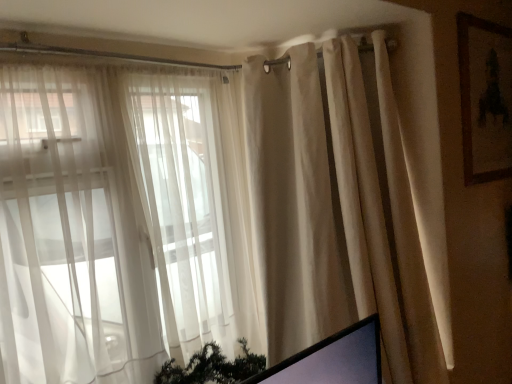
Find the location of `sheer white curtains at left`. sheer white curtains at left is located at coordinates (94, 229).

You are a GUI agent. You are given a task and a screenshot of the screen. Output one action in this format:
    pyautogui.click(x=<x>, y=<y>)
    Task: Click on the brown wooden picture frame at upper right
    The width and height of the screenshot is (512, 384).
    Given the screenshot: What is the action you would take?
    pyautogui.click(x=485, y=98)

You are a GUI agent. You are given a task and a screenshot of the screen. Output one action in this format:
    pyautogui.click(x=<x>, y=<y>)
    Task: Click on the beige fabric curtain at right
    
    Given the screenshot: What is the action you would take?
    pyautogui.click(x=334, y=210)

Looking at this image, from the image's perspective, would you say beige fabric curtain at right is positioned over brown wooden picture frame at upper right?

Incorrect, from the image's perspective, beige fabric curtain at right is lower than brown wooden picture frame at upper right.

How different are the orientations of beige fabric curtain at right and brown wooden picture frame at upper right in degrees?

There is a 48.9-degree angle between the facing directions of beige fabric curtain at right and brown wooden picture frame at upper right.

Could you tell me if beige fabric curtain at right is facing brown wooden picture frame at upper right?

No, beige fabric curtain at right is not aimed at brown wooden picture frame at upper right.

Which object is wider, beige fabric curtain at right or sheer white curtains at left?

beige fabric curtain at right is wider.

Looking at this image, can sheer white curtains at left be found inside beige fabric curtain at right?

Definitely not — sheer white curtains at left is not inside beige fabric curtain at right.

From a real-world perspective, is beige fabric curtain at right above or below sheer white curtains at left?

beige fabric curtain at right is situated lower than sheer white curtains at left in the real world.

Are beige fabric curtain at right and sheer white curtains at left beside each other?

beige fabric curtain at right and sheer white curtains at left are not in contact.

Based on the photo, in terms of width, does sheer white curtains at left look wider or thinner when compared to brown wooden picture frame at upper right?

Clearly, sheer white curtains at left has more width compared to brown wooden picture frame at upper right.

Which object is positioned more to the right, sheer white curtains at left or brown wooden picture frame at upper right?

Positioned to the right is brown wooden picture frame at upper right.

Is point (25, 304) positioned behind point (487, 173)?

No, it is not.

Consider the image. From the image's perspective, which one is positioned lower, sheer white curtains at left or brown wooden picture frame at upper right?

sheer white curtains at left.

Which is correct: brown wooden picture frame at upper right is inside beige fabric curtain at right, or outside of it?

brown wooden picture frame at upper right is spatially situated outside beige fabric curtain at right.

Which of these two, brown wooden picture frame at upper right or beige fabric curtain at right, is smaller?

brown wooden picture frame at upper right is smaller.

From the image's perspective, which object appears higher, brown wooden picture frame at upper right or beige fabric curtain at right?

brown wooden picture frame at upper right, from the image's perspective.

Is brown wooden picture frame at upper right in contact with beige fabric curtain at right?

brown wooden picture frame at upper right and beige fabric curtain at right are not in contact.

Which object is positioned more to the left, sheer white curtains at left or beige fabric curtain at right?

sheer white curtains at left.

Is sheer white curtains at left closer to camera compared to beige fabric curtain at right?

Yes, sheer white curtains at left is in front of beige fabric curtain at right.

From a real-world perspective, is sheer white curtains at left located beneath beige fabric curtain at right?

No, from a real-world perspective, sheer white curtains at left is not beneath beige fabric curtain at right.

Is sheer white curtains at left taller than beige fabric curtain at right?

No.

From the picture: Relative to sheer white curtains at left, is brown wooden picture frame at upper right in front or behind?

Clearly, brown wooden picture frame at upper right is behind sheer white curtains at left.

Is brown wooden picture frame at upper right aimed at sheer white curtains at left?

No, brown wooden picture frame at upper right is not facing towards sheer white curtains at left.

Is point (488, 173) in front of point (181, 129)?

No.

Is brown wooden picture frame at upper right wider or thinner than sheer white curtains at left?

brown wooden picture frame at upper right is thinner than sheer white curtains at left.

Identify the location of curtain lying on the left of brown wooden picture frame at upper right. (334, 210).

Where is `curtain below the sheer white curtains at left (from the image's perspective)`? This screenshot has width=512, height=384. curtain below the sheer white curtains at left (from the image's perspective) is located at coordinates (334, 210).

Considering their positions, is brown wooden picture frame at upper right positioned closer to beige fabric curtain at right than sheer white curtains at left?

sheer white curtains at left.

Which object lies nearer to the anchor point brown wooden picture frame at upper right, sheer white curtains at left or beige fabric curtain at right?

beige fabric curtain at right is positioned closer to the anchor brown wooden picture frame at upper right.

When comparing their distances from sheer white curtains at left, does brown wooden picture frame at upper right or beige fabric curtain at right seem closer?

beige fabric curtain at right is closer to sheer white curtains at left.

Looking at the image, which one is located further to brown wooden picture frame at upper right, beige fabric curtain at right or sheer white curtains at left?

The object further to brown wooden picture frame at upper right is sheer white curtains at left.

Based on their spatial positions, is sheer white curtains at left or brown wooden picture frame at upper right further from beige fabric curtain at right?

Based on the image, brown wooden picture frame at upper right appears to be further to beige fabric curtain at right.

Based on their spatial positions, is beige fabric curtain at right or brown wooden picture frame at upper right closer to sheer white curtains at left?

Among the two, beige fabric curtain at right is located nearer to sheer white curtains at left.

The width and height of the screenshot is (512, 384). I want to click on curtain situated between sheer white curtains at left and brown wooden picture frame at upper right from left to right, so [x=334, y=210].